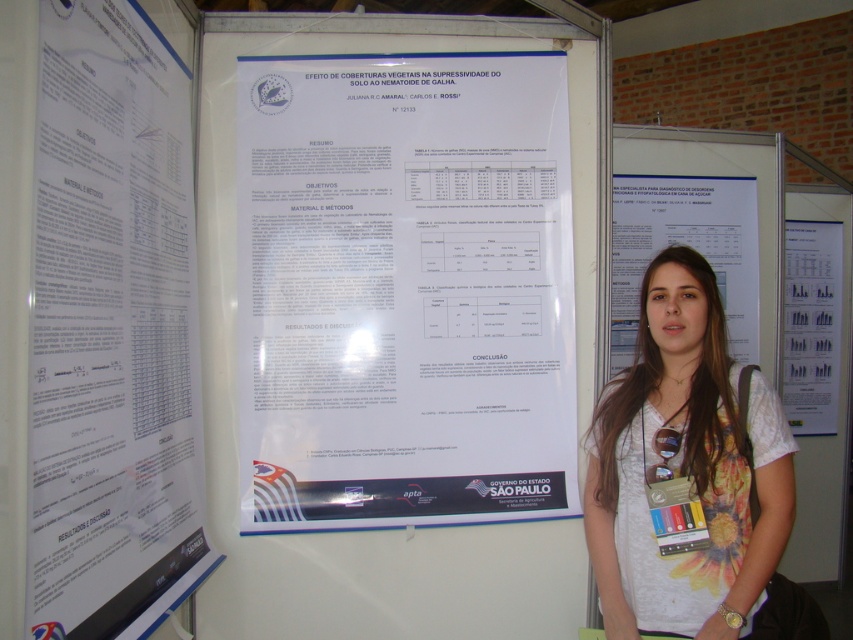
Question: Is white paper poster at upper left bigger than white paper at right?

Choices:
 (A) no
 (B) yes

Answer: (A)

Question: Can you confirm if white paper poster at center is positioned to the right of white paper poster at upper left?

Choices:
 (A) yes
 (B) no

Answer: (A)

Question: Which of these objects is positioned farthest from the white paper at center?

Choices:
 (A) white paper poster at upper left
 (B) white paper at right
 (C) white paper poster at center

Answer: (A)

Question: Which point appears closest to the camera in this image?

Choices:
 (A) (181, 396)
 (B) (473, 506)
 (C) (718, 586)

Answer: (C)

Question: Which point is farther from the camera taking this photo?

Choices:
 (A) (674, 228)
 (B) (653, 291)

Answer: (A)

Question: Is white paper poster at center below white paper poster at upper left?

Choices:
 (A) yes
 (B) no

Answer: (B)